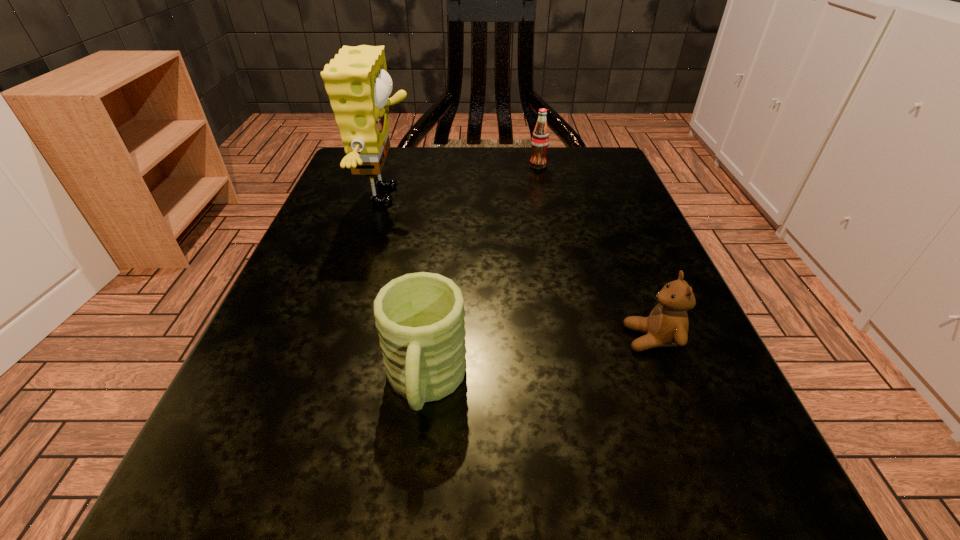
This screenshot has height=540, width=960. What are the coordinates of `unoccupied area between the shortest object and the soda` in the screenshot? It's located at (595, 252).

This screenshot has width=960, height=540. I want to click on free spot between the mug and the rightmost object, so click(x=539, y=362).

The height and width of the screenshot is (540, 960). What are the coordinates of `vacant area that lies between the leftmost object and the third object from left to right` in the screenshot? It's located at 464,181.

This screenshot has height=540, width=960. Identify the location of vacant point located between the leftmost object and the teddy bear. (520, 267).

Where is `vacant area that lies between the second object from left to right and the soda`? Image resolution: width=960 pixels, height=540 pixels. vacant area that lies between the second object from left to right and the soda is located at coordinates (482, 275).

Identify which object is located as the third nearest to the soda. Please provide its 2D coordinates. Your answer should be formatted as a tuple, i.e. [(x, y)], where the tuple contains the x and y coordinates of a point satisfying the conditions above.

[(420, 316)]

I want to click on object that is the second nearest to the teddy bear, so click(356, 80).

Where is `vacant space that satisfies the following two spatial constraints: 1. on the front-facing side of the shortest object; 2. on the side of the second object from left to right with the handle`? The height and width of the screenshot is (540, 960). vacant space that satisfies the following two spatial constraints: 1. on the front-facing side of the shortest object; 2. on the side of the second object from left to right with the handle is located at coordinates (669, 385).

This screenshot has height=540, width=960. In order to click on free spot that satisfies the following two spatial constraints: 1. on the front-facing side of the rightmost object; 2. on the side of the third object from right to left with the handle in this screenshot , I will do `click(669, 385)`.